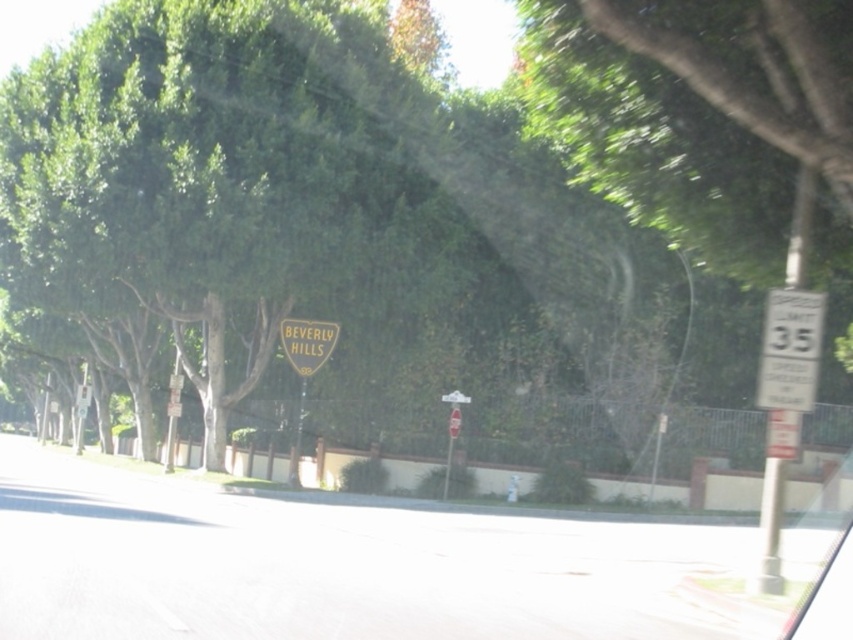
Question: Is white plastic speed limit sign at right thinner than yellowmaterial/texturebeverly hills sign at center?

Choices:
 (A) yes
 (B) no

Answer: (B)

Question: Among these objects, which one is nearest to the camera?

Choices:
 (A) white plastic speed limit sign at right
 (B) yellowmaterial/texturebeverly hills sign at center

Answer: (A)

Question: Which of the following is the closest to the observer?

Choices:
 (A) (805, 397)
 (B) (314, 339)

Answer: (A)

Question: Can you confirm if white plastic speed limit sign at right is thinner than yellowmaterial/texturebeverly hills sign at center?

Choices:
 (A) yes
 (B) no

Answer: (B)

Question: Is the position of white plastic speed limit sign at right more distant than that of yellowmaterial/texturebeverly hills sign at center?

Choices:
 (A) no
 (B) yes

Answer: (A)